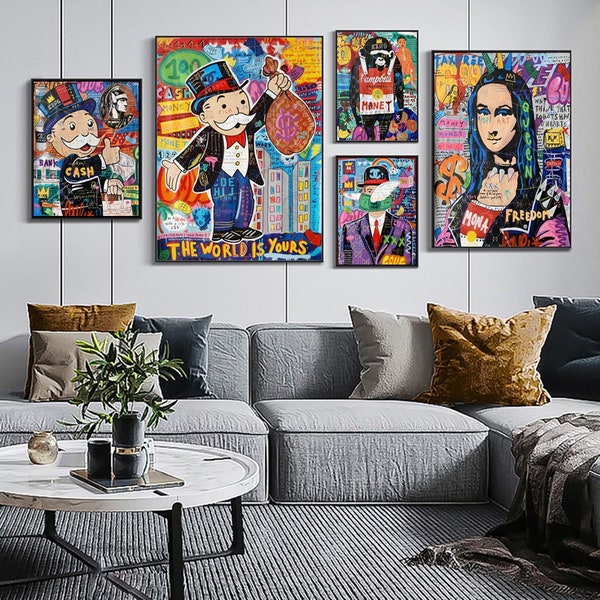
The width and height of the screenshot is (600, 600). I want to click on plant, so click(x=121, y=380).